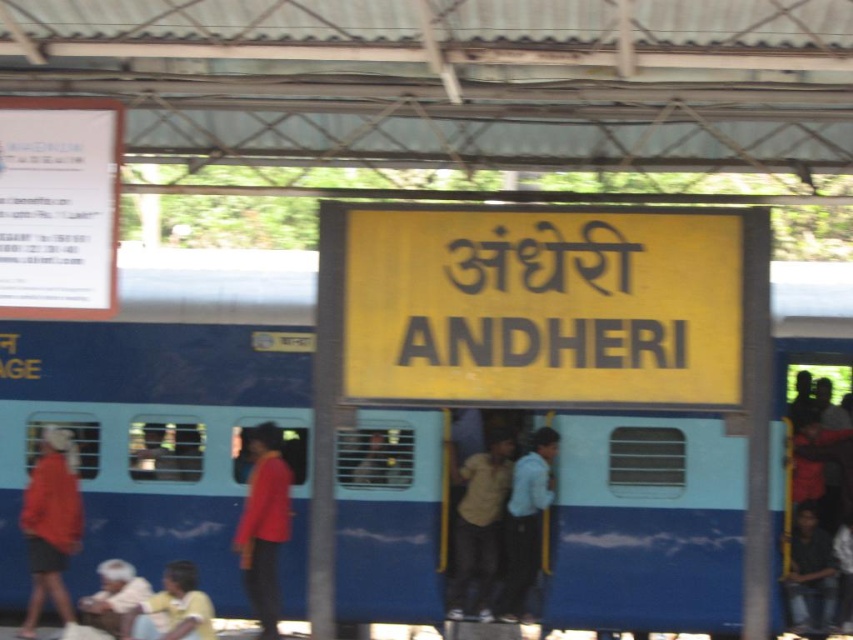
Who is more distant from viewer, (570, 561) or (186, 570)?

The point (570, 561) is more distant.

Based on the photo, between blue metallic train at center and yellow fabric shirt at lower left, which one has more height?

blue metallic train at center is taller.

Between point (281, 332) and point (189, 636), which one is positioned in front?

Point (189, 636) is in front.

You are a GUI agent. You are given a task and a screenshot of the screen. Output one action in this format:
    pyautogui.click(x=<x>, y=<y>)
    Task: Click on the blue metallic train at center
    
    Given the screenshot: What is the action you would take?
    pyautogui.click(x=165, y=412)

Who is positioned more to the left, blue metallic train at center or dark blue shirt at lower right?

Positioned to the left is blue metallic train at center.

Who is lower down, blue metallic train at center or dark blue shirt at lower right?

Positioned lower is dark blue shirt at lower right.

Describe the element at coordinates (165, 412) in the screenshot. I see `blue metallic train at center` at that location.

Where is `blue metallic train at center`? The height and width of the screenshot is (640, 853). blue metallic train at center is located at coordinates (165, 412).

From the picture: Is matte red dress at left shorter than white fabric headscarf at lower left?

In fact, matte red dress at left may be taller than white fabric headscarf at lower left.

Is point (24, 624) farther from viewer compared to point (117, 605)?

Yes.

Which is behind, point (57, 604) or point (82, 620)?

The point (57, 604) is behind.

Image resolution: width=853 pixels, height=640 pixels. Identify the location of matte red dress at left. (51, 524).